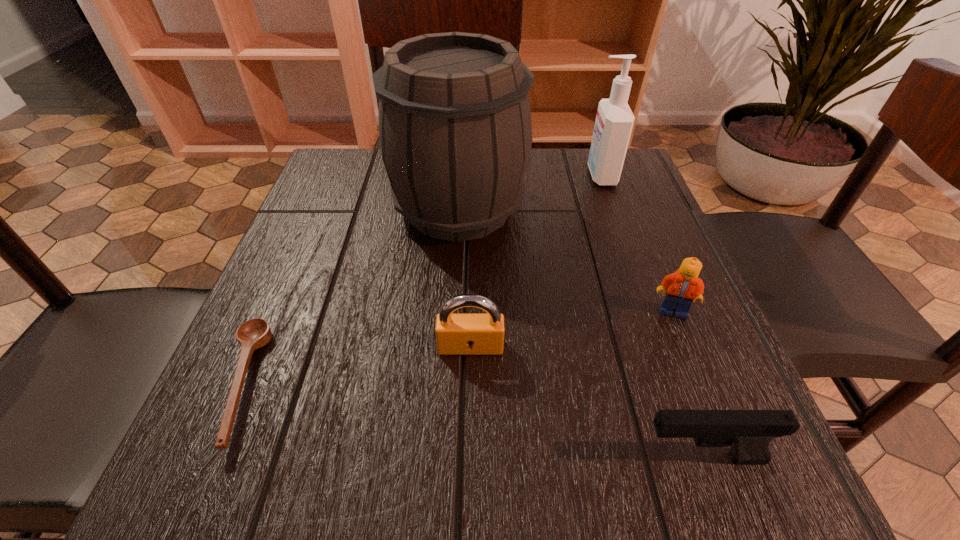
The image size is (960, 540). In order to click on vacant position at the left edge of the desktop in this screenshot , I will do `click(324, 299)`.

Locate an element on the screen. Image resolution: width=960 pixels, height=540 pixels. vacant space at the right edge is located at coordinates (637, 298).

In the image, there is a desktop. What are the coordinates of `vacant region at the far left corner` in the screenshot? It's located at (355, 158).

I want to click on vacant space at the far right corner of the desktop, so point(575,165).

At what (x,y) coordinates should I click in order to perform the action: click on vacant region between the tallest object and the second tallest object. Please return your answer as a coordinate pair (x, y). This screenshot has height=540, width=960. Looking at the image, I should click on (530, 192).

Where is `free space between the tallest object and the fifth shortest object`? free space between the tallest object and the fifth shortest object is located at coordinates (530, 192).

This screenshot has height=540, width=960. Find the location of `free spot between the pistol and the leftmost object`. free spot between the pistol and the leftmost object is located at coordinates (470, 421).

Find the location of a particular element. This screenshot has width=960, height=540. vacant area that lies between the pistol and the tallest object is located at coordinates (580, 333).

Locate an element on the screen. This screenshot has width=960, height=540. free area in between the fourth nearest object and the padlock is located at coordinates (571, 329).

Find the location of a particular element. This screenshot has width=960, height=540. vacant space in between the padlock and the fourth nearest object is located at coordinates (571, 329).